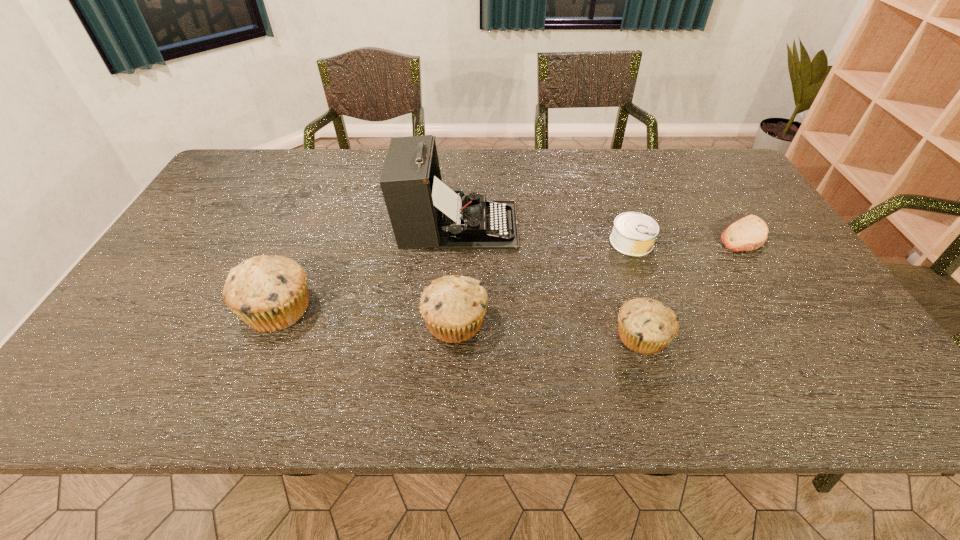
Identify the location of the leftmost muffin. (268, 293).

Locate an element on the screen. the second muffin from left to right is located at coordinates (453, 306).

Where is `the fourth shortest object`? Image resolution: width=960 pixels, height=540 pixels. the fourth shortest object is located at coordinates coord(453,306).

Identify the location of the rightmost muffin. The image size is (960, 540). (646, 326).

Locate an element on the screen. The height and width of the screenshot is (540, 960). the shortest muffin is located at coordinates (646, 326).

Where is `can`? The height and width of the screenshot is (540, 960). can is located at coordinates (633, 234).

The height and width of the screenshot is (540, 960). Find the location of `pita bread`. pita bread is located at coordinates (749, 233).

Locate an element on the screen. The image size is (960, 540). the shortest object is located at coordinates (749, 233).

Find the location of a particular element. The image size is (960, 540). the tallest object is located at coordinates (424, 212).

Identify the location of free location located on the right of the leftmost muffin. (348, 309).